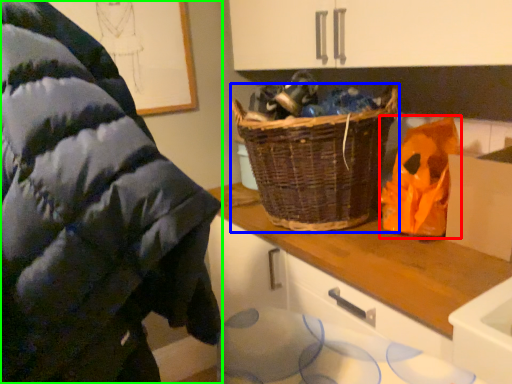
Question: Which is nearer to the waste (highlighted by a red box)? picnic basket (highlighted by a blue box) or wool (highlighted by a green box).

Choices:
 (A) picnic basket
 (B) wool

Answer: (A)